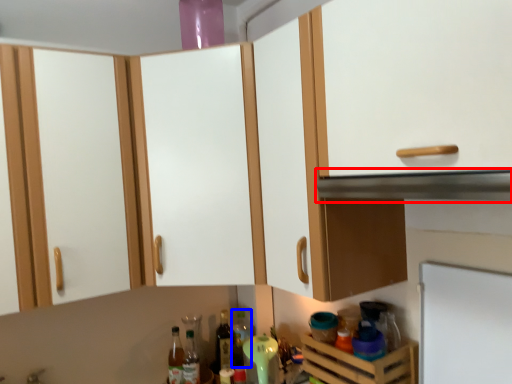
Question: Which of the following is the farthest to the observer, vent (highlighted by a red box) or bottle (highlighted by a blue box)?

Choices:
 (A) vent
 (B) bottle

Answer: (B)